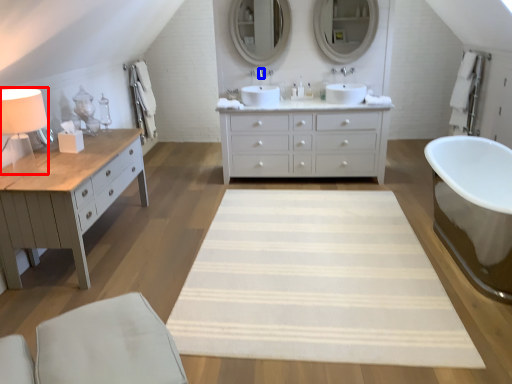
Question: Which point is further to the camera, table lamp (highlighted by a red box) or faucet (highlighted by a blue box)?

Choices:
 (A) table lamp
 (B) faucet

Answer: (B)